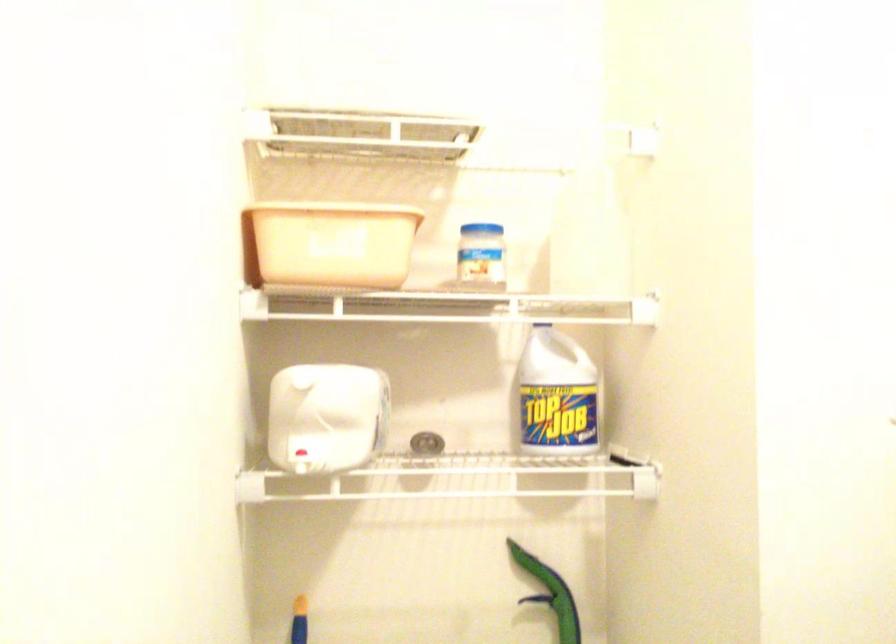
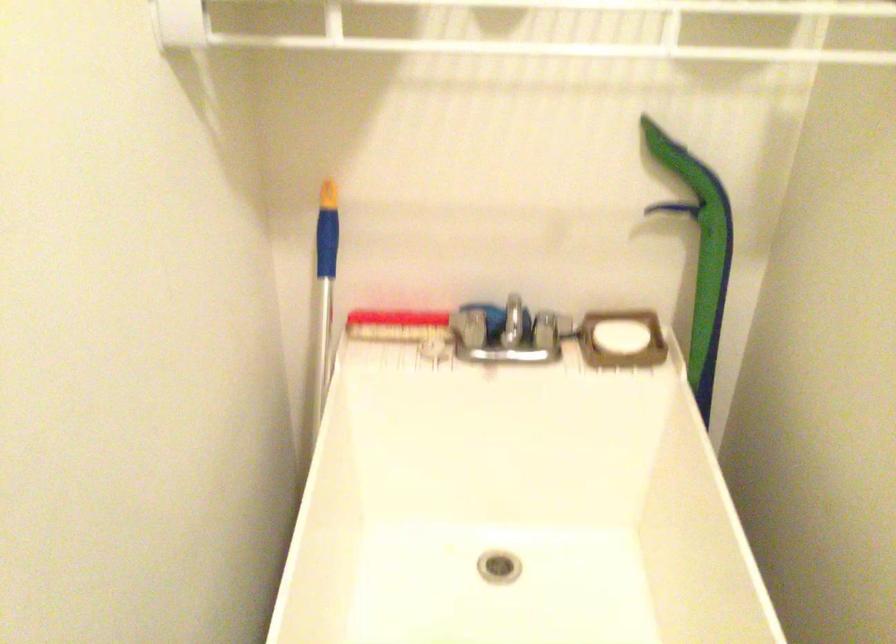
Question: The first image is from the beginning of the video and the second image is from the end. How did the camera likely rotate when shooting the video?

Choices:
 (A) Left
 (B) Right
 (C) Up
 (D) Down

Answer: (D)